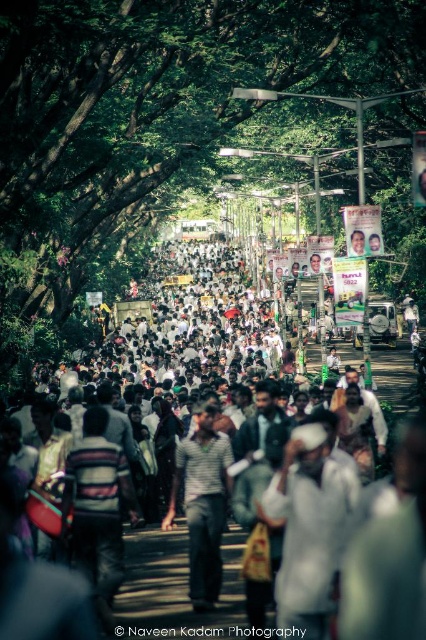
Question: Does white clothed crowd at center appear on the left side of white cotton shirt at center?

Choices:
 (A) yes
 (B) no

Answer: (A)

Question: Based on their relative distances, which object is farther from the striped fabric shirt at center?

Choices:
 (A) green leafy tree at center
 (B) white cotton shirt at center
 (C) white clothed crowd at center

Answer: (A)

Question: Which object is farther from the camera taking this photo?

Choices:
 (A) striped fabric shirt at center
 (B) white clothed crowd at center

Answer: (A)

Question: Which of the following is the farthest from the observer?

Choices:
 (A) green leafy tree at center
 (B) white clothed crowd at center

Answer: (A)

Question: Can you confirm if green leafy tree at center is positioned above white cotton shirt at center?

Choices:
 (A) no
 (B) yes

Answer: (B)

Question: Where is white clothed crowd at center located in relation to white cotton shirt at center in the image?

Choices:
 (A) below
 (B) above

Answer: (B)